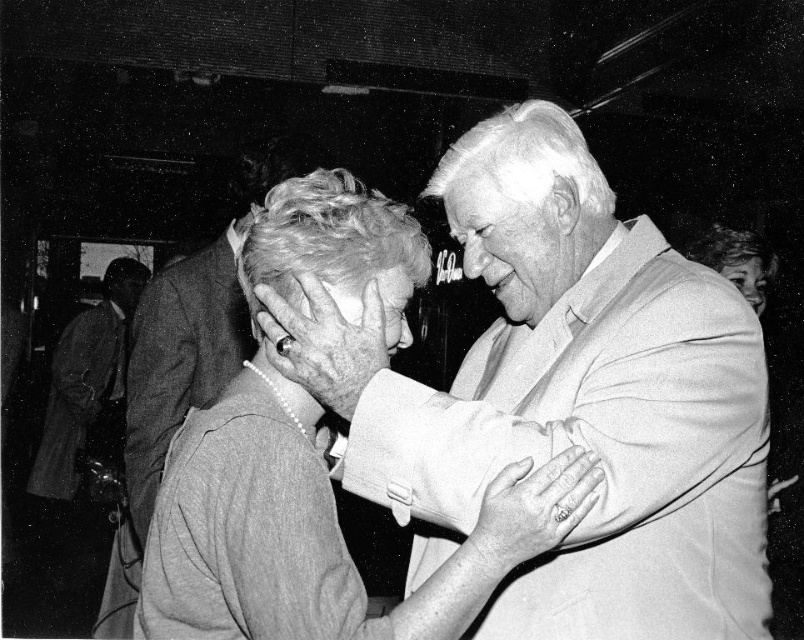
Is point (587, 253) less distant than point (468, 150)?

Yes, it is.

Image resolution: width=804 pixels, height=640 pixels. Identify the location of smooth gray sweater at center. point(576,412).

Locate an element on the screen. This screenshot has width=804, height=640. smooth gray sweater at center is located at coordinates (576, 412).

Based on the photo, is the position of smooth skin face at center less distant than that of smooth gray hair at center?

Yes, smooth skin face at center is in front of smooth gray hair at center.

Does smooth skin face at center lie behind smooth gray hair at center?

No, it is not.

Identify the location of smooth skin face at center. (515, 243).

Can you confirm if smooth beige suit at upper right is positioned above smooth gray hair at center?

Incorrect, smooth beige suit at upper right is not positioned above smooth gray hair at center.

Between smooth beige suit at upper right and smooth gray hair at center, which one is positioned higher?

smooth gray hair at center is higher up.

This screenshot has height=640, width=804. I want to click on smooth beige suit at upper right, so click(524, 205).

What are the coordinates of `smooth beige suit at upper right` in the screenshot? It's located at (524, 205).